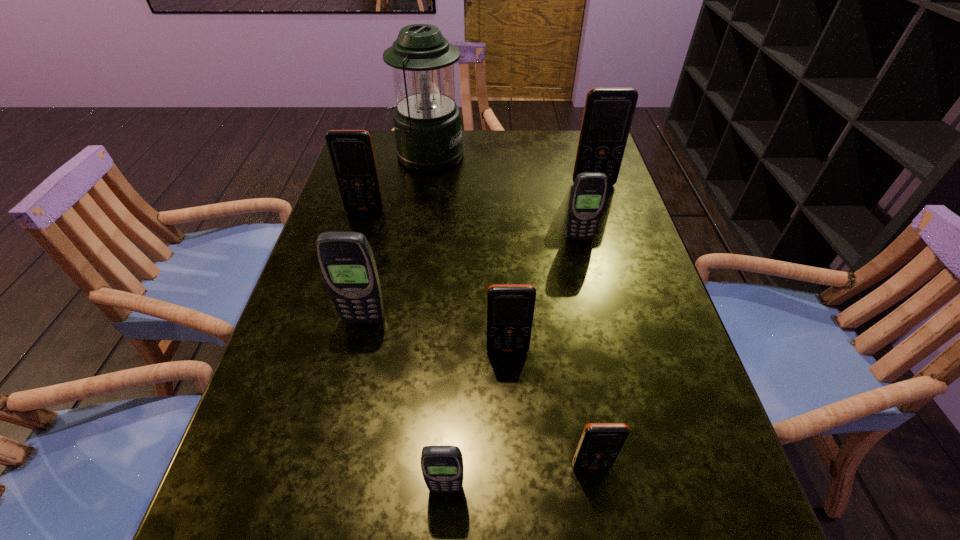
Locate an element on the screen. vacant space located 0.380m on the screen of the farthest gray cellular telephone is located at coordinates (613, 378).

Find the location of `free space located on the screen of the fifth farthest cellular telephone`. free space located on the screen of the fifth farthest cellular telephone is located at coordinates (513, 449).

Locate an element on the screen. vacant area situated 0.060m on the screen of the second gray cellular telephone from right to left is located at coordinates (444, 537).

The height and width of the screenshot is (540, 960). Find the location of `object that is at the far edge`. object that is at the far edge is located at coordinates (427, 122).

In order to click on lantern present at the left edge in this screenshot , I will do `click(427, 122)`.

The image size is (960, 540). I want to click on object located at the far left corner, so click(427, 122).

Image resolution: width=960 pixels, height=540 pixels. In the image, there is a desktop. Identify the location of vacant space at the far edge. (482, 153).

You are a GUI agent. You are given a task and a screenshot of the screen. Output one action in this format:
    pyautogui.click(x=<x>, y=<y>)
    Task: Click on the blank space at the left edge of the desktop
    The width and height of the screenshot is (960, 540).
    Given the screenshot: What is the action you would take?
    pyautogui.click(x=266, y=388)

Locate an element on the screen. Image resolution: width=960 pixels, height=540 pixels. free spot between the third orange cellular telephone from left to right and the third nearest object is located at coordinates (549, 408).

The height and width of the screenshot is (540, 960). I want to click on free space between the second biggest gray cellular telephone and the sixth farthest object, so click(x=543, y=294).